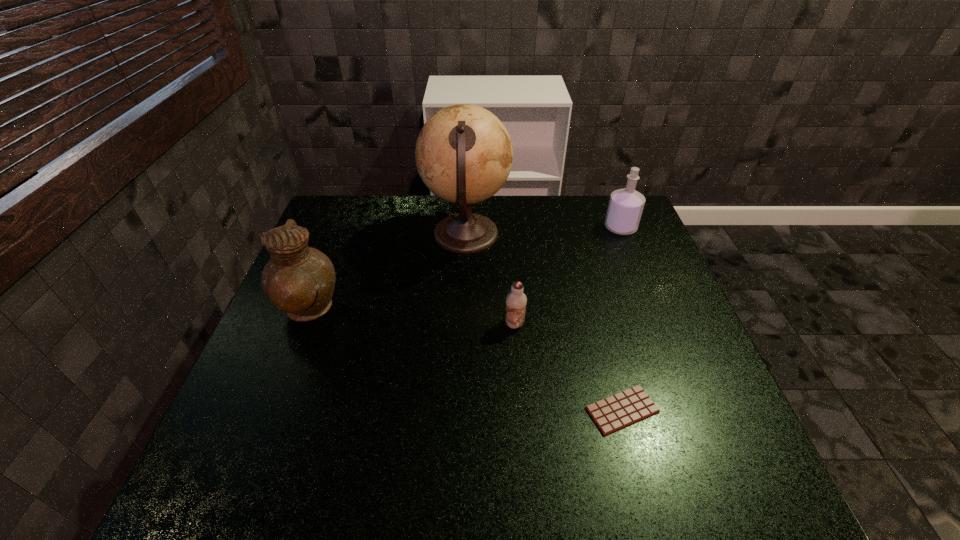
Find the location of a particular element. the tallest object is located at coordinates (464, 155).

Locate an element on the screen. This screenshot has width=960, height=540. the second tallest object is located at coordinates (299, 280).

Image resolution: width=960 pixels, height=540 pixels. I want to click on the leftmost object, so click(x=299, y=280).

The height and width of the screenshot is (540, 960). What are the coordinates of `perfume` in the screenshot? It's located at (625, 208).

Image resolution: width=960 pixels, height=540 pixels. In order to click on the rightmost object in this screenshot , I will do `click(625, 208)`.

Find the location of a particular element. the second shortest object is located at coordinates (516, 300).

Where is `candy bar`? This screenshot has width=960, height=540. candy bar is located at coordinates (613, 413).

The image size is (960, 540). I want to click on the nearest object, so click(x=613, y=413).

Locate an element on the screen. Image resolution: width=960 pixels, height=540 pixels. vacant space situated on the front-facing side of the tallest object is located at coordinates (604, 235).

At what (x,y) coordinates should I click in order to perform the action: click on blank space located 0.360m at the spout of the fourth shortest object. Please return your answer as a coordinate pair (x, y). The width and height of the screenshot is (960, 540). Looking at the image, I should click on (482, 312).